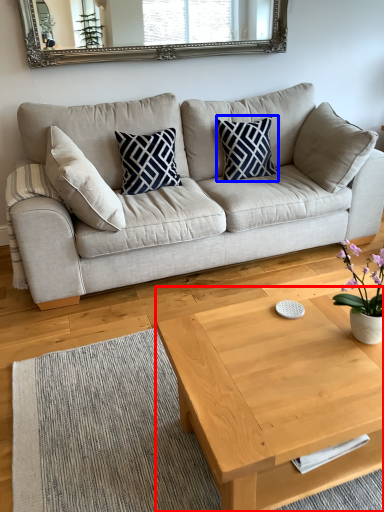
Question: Among these objects, which one is farthest to the camera, coffee table (highlighted by a red box) or pillow (highlighted by a blue box)?

Choices:
 (A) coffee table
 (B) pillow

Answer: (B)